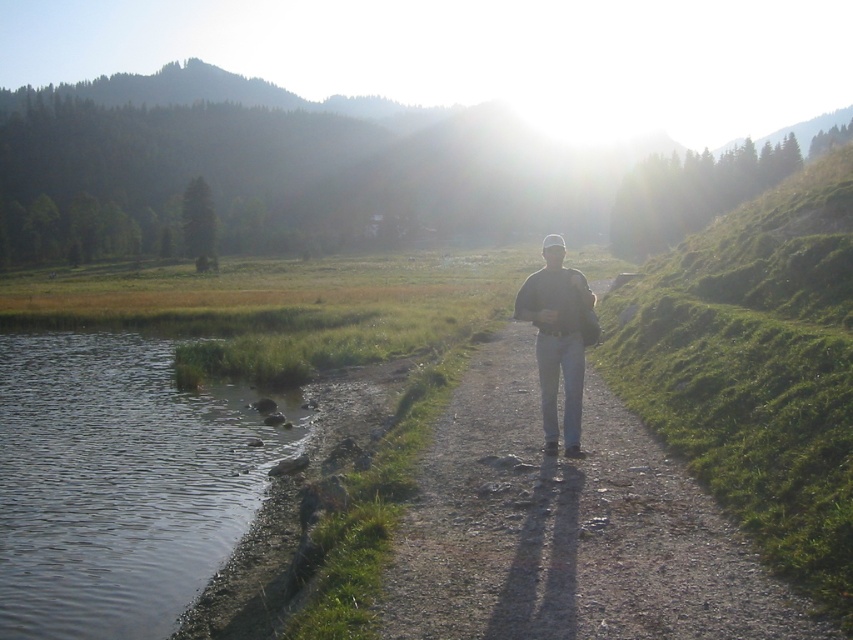
Does dirt/gravel path at center appear on the left side of clear water at lower left?

Incorrect, dirt/gravel path at center is not on the left side of clear water at lower left.

Which is in front, point (688, 504) or point (67, 522)?

Point (688, 504) is more forward.

The image size is (853, 640). I want to click on dirt/gravel path at center, so click(x=567, y=529).

Who is taller, green grassy hillside at center or gray cotton shirt at center?

green grassy hillside at center

Which is below, green grassy hillside at center or gray cotton shirt at center?

gray cotton shirt at center is below.

Which is in front, point (604, 184) or point (555, 282)?

Point (555, 282) is more forward.

The image size is (853, 640). In order to click on green grassy hillside at center in this screenshot , I will do coord(334,172).

Consider the image. Is clear water at lower left taller than gray cotton shirt at center?

Incorrect, clear water at lower left's height is not larger of gray cotton shirt at center's.

Is clear water at lower left positioned at the back of gray cotton shirt at center?

No, it is not.

Who is more distant from viewer, (235, 529) or (543, 394)?

The point (235, 529) is more distant.

Where is `clear water at lower left`? clear water at lower left is located at coordinates (119, 483).